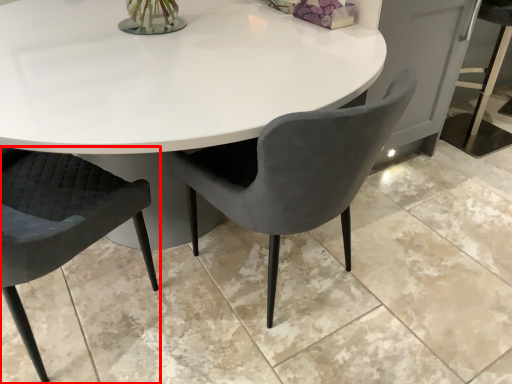
Question: In this image, where is chair (annotated by the red box) located relative to chair?

Choices:
 (A) right
 (B) left

Answer: (B)